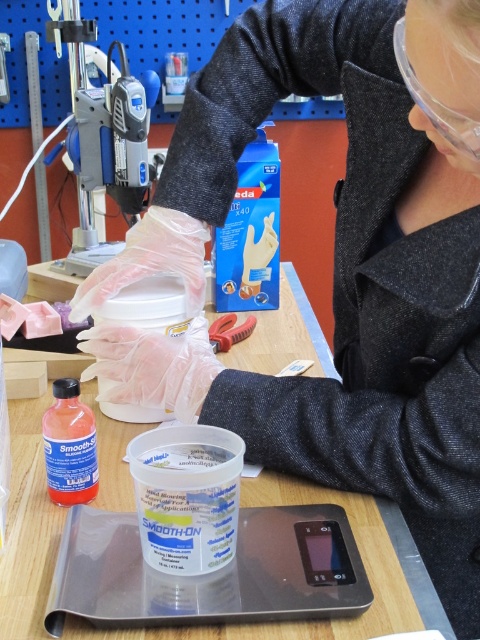
Between translucent orange liquid at center and clear plastic goggles at upper right, which one has more height?

translucent orange liquid at center

Which is above, translucent orange liquid at center or clear plastic goggles at upper right?

clear plastic goggles at upper right

Measure the distance between point (92, 467) and camera.

Point (92, 467) is 69.92 centimeters away from camera.

Identify the location of translucent orange liquid at center. The height and width of the screenshot is (640, 480). (70, 445).

Is point (427, 99) farther from viewer compared to point (228, 323)?

No.

Between clear plastic goggles at upper right and rubberized plastic pliers at center, which one is positioned lower?

Positioned lower is rubberized plastic pliers at center.

Measure the distance between clear plastic goggles at upper right and camera.

A distance of 17.81 inches exists between clear plastic goggles at upper right and camera.

Identify the location of clear plastic goggles at upper right. (435, 104).

The width and height of the screenshot is (480, 640). Describe the element at coordinates (70, 445) in the screenshot. I see `translucent orange liquid at center` at that location.

The height and width of the screenshot is (640, 480). Identify the location of translucent orange liquid at center. (70, 445).